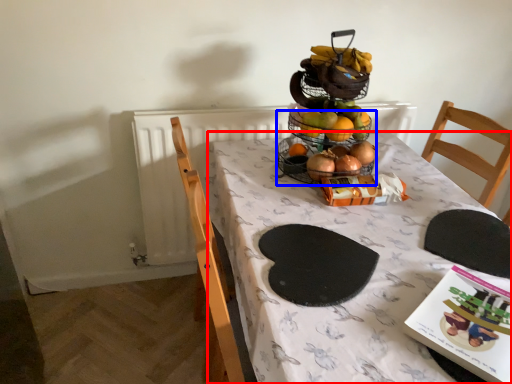
Question: Which point is closer to the camera, table (highlighted by a red box) or basket (highlighted by a blue box)?

Choices:
 (A) table
 (B) basket

Answer: (A)